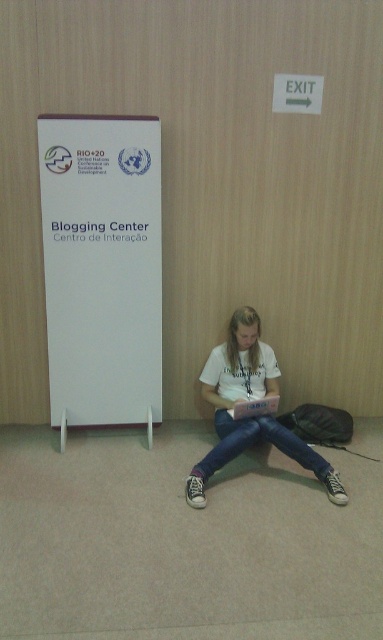
Between white paper at left and white cotton shirt at center, which one is positioned lower?

white cotton shirt at center is lower down.

Based on the photo, can you confirm if white paper at left is thinner than white cotton shirt at center?

Yes.

You are a GUI agent. You are given a task and a screenshot of the screen. Output one action in this format:
    pyautogui.click(x=<x>, y=<y>)
    Task: Click on the white paper at left
    Image resolution: width=383 pixels, height=640 pixels.
    Given the screenshot: What is the action you would take?
    pyautogui.click(x=101, y=268)